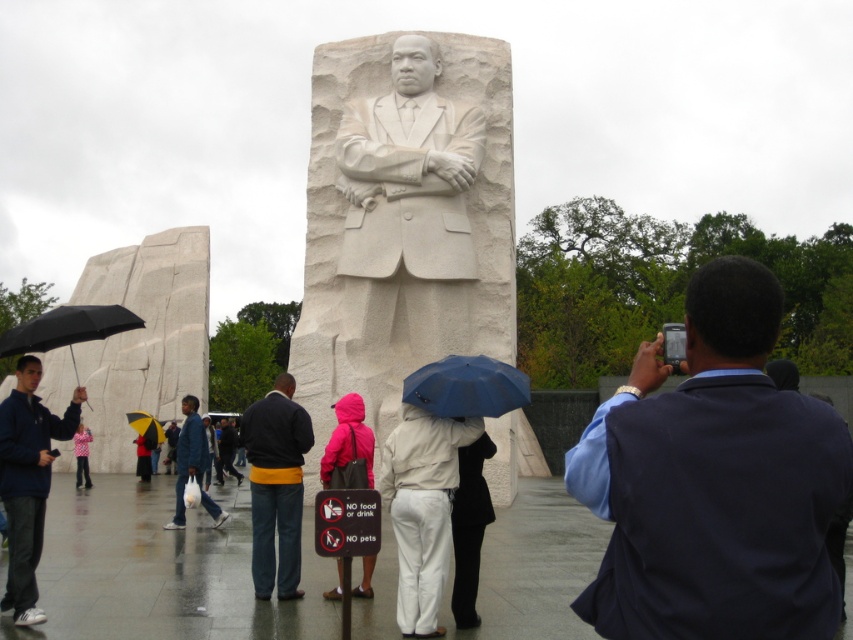
Question: Where is dark blue jacket with yellow stripe at center located in relation to blue matte umbrella at center in the image?

Choices:
 (A) below
 (B) above

Answer: (A)

Question: Observing the image, what is the correct spatial positioning of white matte pants at center in reference to yellowumbrella at left?

Choices:
 (A) below
 (B) above

Answer: (B)

Question: Observing the image, what is the correct spatial positioning of white matte pants at center in reference to dark blue jacket at left?

Choices:
 (A) right
 (B) left

Answer: (A)

Question: Considering the real-world distances, which object is closest to the dark blue jacket at left?

Choices:
 (A) yellowumbrella at left
 (B) dark blue jacket with yellow stripe at center

Answer: (B)

Question: Among these objects, which one is farthest from the camera?

Choices:
 (A) white matte pants at center
 (B) yellow matte umbrella at center
 (C) yellowumbrella at left

Answer: (B)

Question: Which object appears closest to the camera in this image?

Choices:
 (A) yellow matte umbrella at center
 (B) white matte pants at center

Answer: (B)